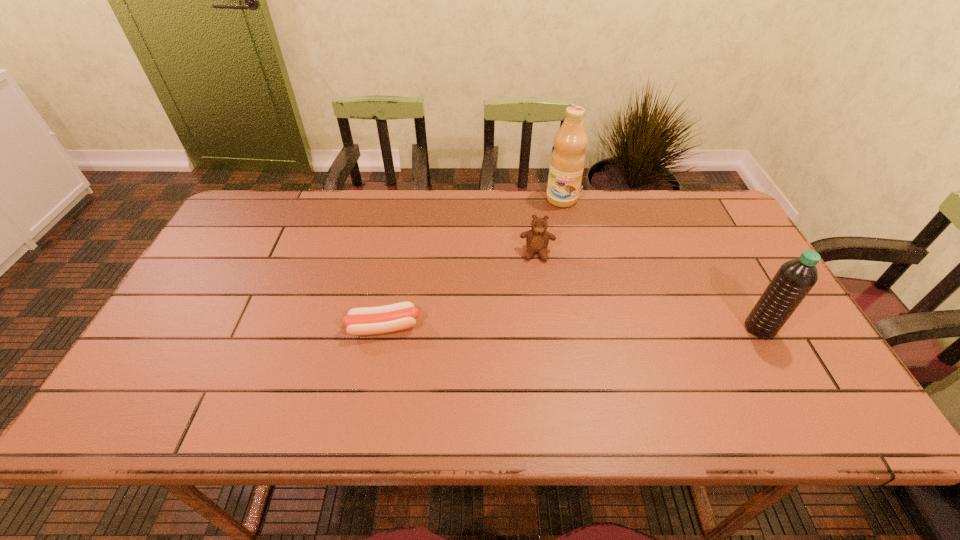
I want to click on vacant area that lies between the third object from left to right and the teddy bear, so click(549, 226).

At what (x,y) coordinates should I click in order to perform the action: click on free space between the sausage and the farthest object. Please return your answer as a coordinate pair (x, y). This screenshot has width=960, height=540. Looking at the image, I should click on (472, 263).

What are the coordinates of `free spot between the farthest object and the second object from left to right` in the screenshot? It's located at (549, 226).

You are a GUI agent. You are given a task and a screenshot of the screen. Output one action in this format:
    pyautogui.click(x=<x>, y=<y>)
    Task: Click on the free space between the second object from left to right and the second object from right to left
    This screenshot has width=960, height=540.
    Given the screenshot: What is the action you would take?
    pyautogui.click(x=549, y=226)

Locate an element on the screen. object that stands as the second closest to the tallest object is located at coordinates 794,279.

Locate an element on the screen. the third closest object to the olive oil is located at coordinates (382, 319).

Identify the location of free location that satisfies the following two spatial constraints: 1. on the front side of the water bottle; 2. on the left side of the farthest object. Image resolution: width=960 pixels, height=540 pixels. (589, 328).

The width and height of the screenshot is (960, 540). Identify the location of free point that satisfies the following two spatial constraints: 1. on the front side of the water bottle; 2. on the left side of the olive oil. (589, 328).